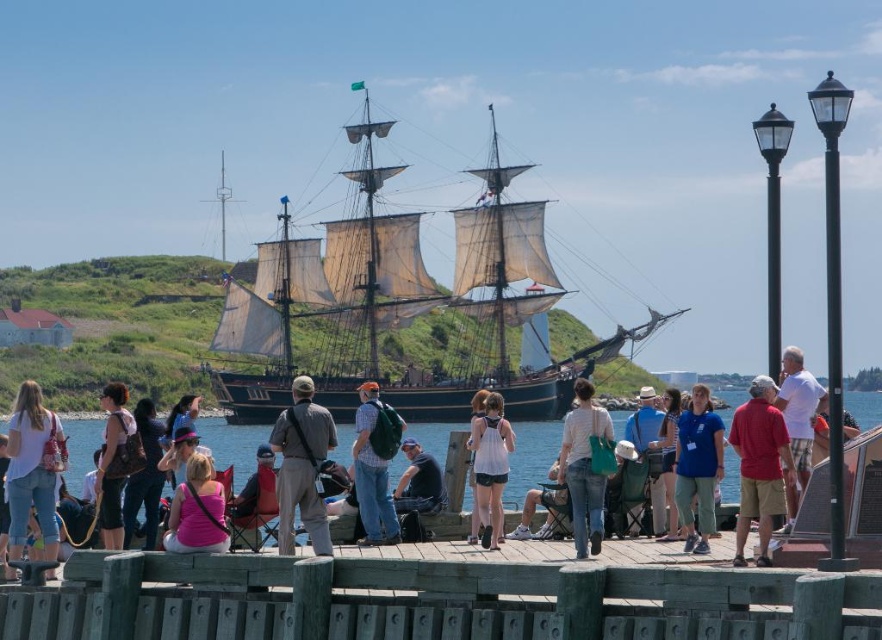
Between white cotton shirt at lower left and blue fabric backpack at center, which one has more height?

With more height is white cotton shirt at lower left.

The width and height of the screenshot is (882, 640). Describe the element at coordinates (32, 470) in the screenshot. I see `white cotton shirt at lower left` at that location.

Which is behind, point (24, 540) or point (656, 525)?

Point (656, 525)

Identify the location of white cotton shirt at lower left. This screenshot has height=640, width=882. (32, 470).

Is denim jeans at center to the left of white cotton shirt at right from the viewer's perspective?

Correct, you'll find denim jeans at center to the left of white cotton shirt at right.

Is point (611, 436) farther from viewer compared to point (783, 356)?

Yes.

Where is `denim jeans at center`? denim jeans at center is located at coordinates (584, 468).

Does point (109, 445) come behind point (126, 532)?

Yes, it is behind point (126, 532).

From the picture: Does matte brown backpack at center have a greater height compared to leather backpack at center?

Indeed, matte brown backpack at center has a greater height compared to leather backpack at center.

Who is more forward, (103,452) or (155,458)?

Positioned in front is point (103,452).

At what (x,y) coordinates should I click in order to perform the action: click on matte brown backpack at center. Please return your answer as a coordinate pair (x, y). Looking at the image, I should click on (114, 461).